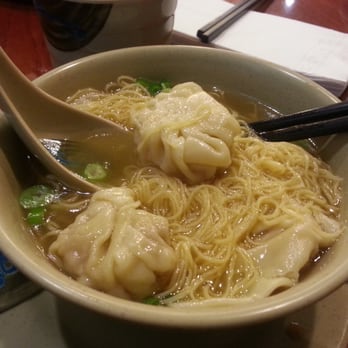
I want to click on bowl, so click(87, 298).